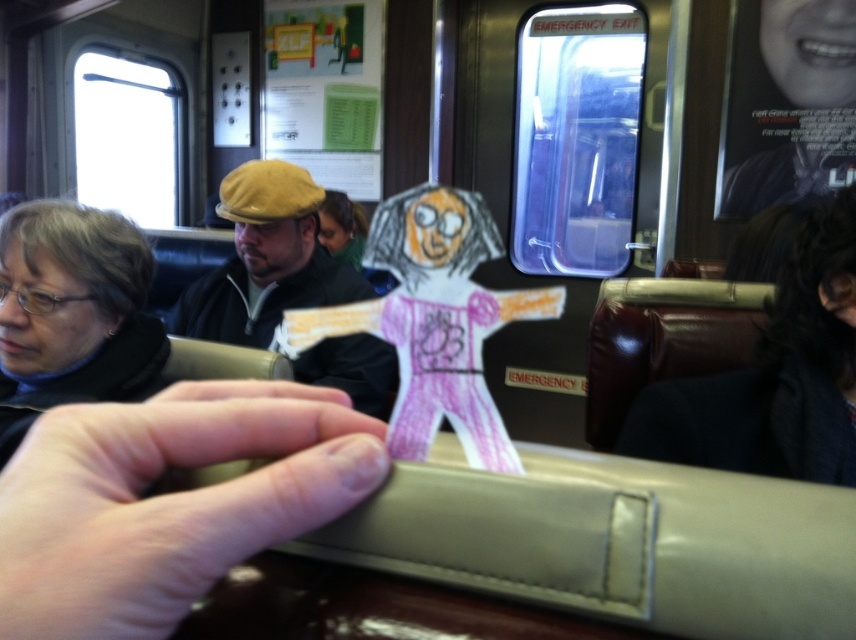
Is point (4, 616) positioned before point (337, 268)?

That is True.

From the picture: Can you confirm if pink flesh-toned hand at center is shorter than matte black jacket at center?

Correct, pink flesh-toned hand at center is not as tall as matte black jacket at center.

The image size is (856, 640). Describe the element at coordinates (167, 500) in the screenshot. I see `pink flesh-toned hand at center` at that location.

Find the location of a particular element. pink flesh-toned hand at center is located at coordinates (167, 500).

Does pink flesh-toned hand at center have a larger size compared to matte black jacket at left?

No.

Locate an element on the screen. pink flesh-toned hand at center is located at coordinates (167, 500).

Does matte black jacket at left have a lesser width compared to matte black jacket at center?

Yes, matte black jacket at left is thinner than matte black jacket at center.

Does point (16, 333) lie in front of point (275, 288)?

Yes, point (16, 333) is in front of point (275, 288).

The width and height of the screenshot is (856, 640). Describe the element at coordinates (72, 312) in the screenshot. I see `matte black jacket at left` at that location.

You are a GUI agent. You are given a task and a screenshot of the screen. Output one action in this format:
    pyautogui.click(x=<x>, y=<y>)
    Task: Click on the matte black jacket at left
    The image size is (856, 640).
    Given the screenshot: What is the action you would take?
    pyautogui.click(x=72, y=312)